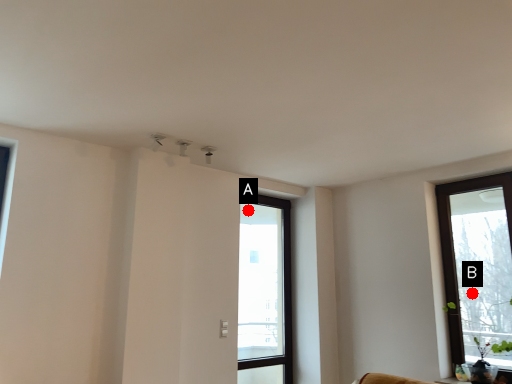
Question: Two points are circled on the image, labeled by A and B beside each circle. Which of the following is the closest to the observer?

Choices:
 (A) A is closer
 (B) B is closer

Answer: (B)